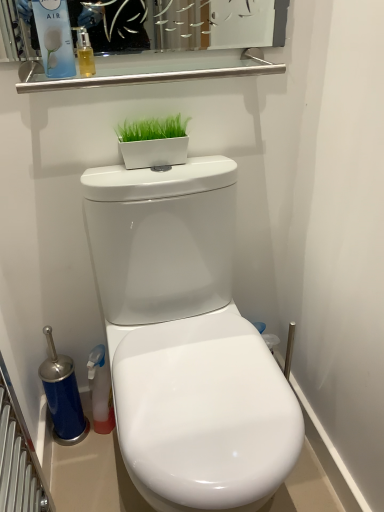
Question: Does matte blue air freshener at upper left have a lesser width compared to translucent amber liquid at upper left?

Choices:
 (A) yes
 (B) no

Answer: (B)

Question: Could you tell me if matte blue air freshener at upper left is facing translucent amber liquid at upper left?

Choices:
 (A) yes
 (B) no

Answer: (B)

Question: Does matte blue air freshener at upper left have a larger size compared to translucent amber liquid at upper left?

Choices:
 (A) no
 (B) yes

Answer: (B)

Question: From a real-world perspective, is matte blue air freshener at upper left physically above translucent amber liquid at upper left?

Choices:
 (A) no
 (B) yes

Answer: (B)

Question: Is translucent amber liquid at upper left inside matte blue air freshener at upper left?

Choices:
 (A) no
 (B) yes

Answer: (A)

Question: Is point (82, 49) positioned closer to the camera than point (261, 481)?

Choices:
 (A) farther
 (B) closer

Answer: (A)

Question: From the image's perspective, relative to white glossy toilet at center, is translucent amber liquid at upper left above or below?

Choices:
 (A) above
 (B) below

Answer: (A)

Question: In terms of height, does translucent amber liquid at upper left look taller or shorter compared to white glossy toilet at center?

Choices:
 (A) tall
 (B) short

Answer: (B)

Question: Considering the relative positions of translucent amber liquid at upper left and white glossy toilet at center in the image provided, is translucent amber liquid at upper left to the left or to the right of white glossy toilet at center?

Choices:
 (A) right
 (B) left

Answer: (B)

Question: Does point (185, 139) appear closer or farther from the camera than point (59, 52)?

Choices:
 (A) farther
 (B) closer

Answer: (A)

Question: From their relative heights in the image, would you say white glossy flowerpot at upper center is taller or shorter than matte blue air freshener at upper left?

Choices:
 (A) short
 (B) tall

Answer: (A)

Question: Based on their sizes in the image, would you say white glossy flowerpot at upper center is bigger or smaller than matte blue air freshener at upper left?

Choices:
 (A) big
 (B) small

Answer: (B)

Question: From the image's perspective, relative to matte blue air freshener at upper left, is white glossy flowerpot at upper center above or below?

Choices:
 (A) below
 (B) above

Answer: (A)

Question: Considering the relative positions of white glossy toilet at center and white glossy flowerpot at upper center in the image provided, is white glossy toilet at center to the left or to the right of white glossy flowerpot at upper center?

Choices:
 (A) right
 (B) left

Answer: (A)

Question: From a real-world perspective, is white glossy toilet at center positioned above or below white glossy flowerpot at upper center?

Choices:
 (A) below
 (B) above

Answer: (A)